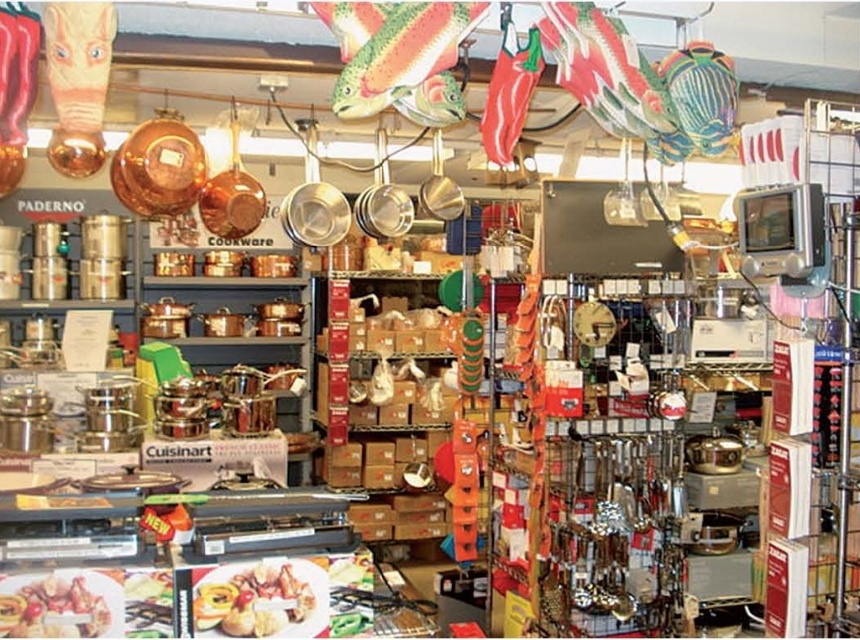
Does golden brown bread at center appear on the right side of golden brown crispy chicken at center?

Indeed, golden brown bread at center is positioned on the right side of golden brown crispy chicken at center.

Does golden brown bread at center appear under golden brown crispy chicken at center?

Yes.

Does point (286, 614) lie behind point (34, 605)?

Yes, it is behind point (34, 605).

Image resolution: width=860 pixels, height=640 pixels. I want to click on golden brown bread at center, so click(x=259, y=598).